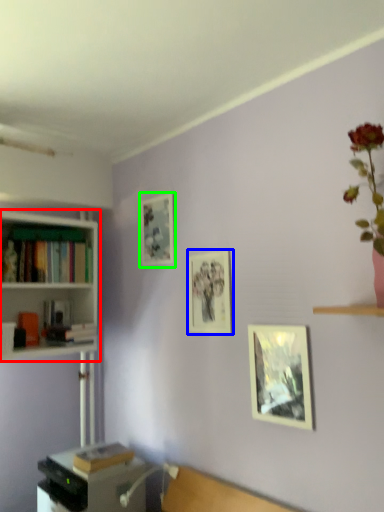
Question: Estimate the real-world distances between objects in this image. Which object is farther from bookcase (highlighted by a red box), picture frame (highlighted by a blue box) or picture frame (highlighted by a green box)?

Choices:
 (A) picture frame
 (B) picture frame

Answer: (A)